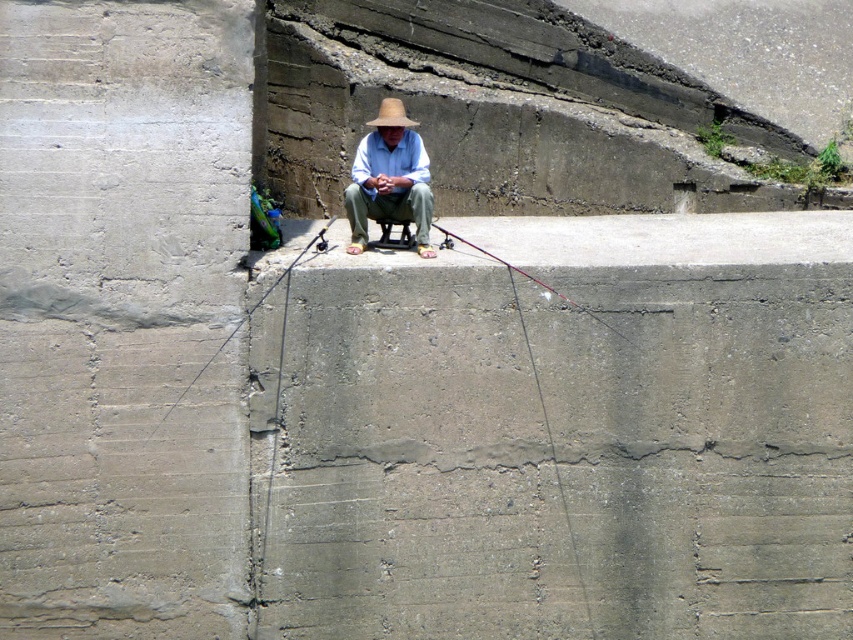
Can you confirm if matte straw hat at center is wider than beige woven straw hat at center?

Yes.

Is matte straw hat at center taller than beige woven straw hat at center?

Yes.

What are the coordinates of `matte straw hat at center` in the screenshot? It's located at click(x=389, y=179).

You are a GUI agent. You are given a task and a screenshot of the screen. Output one action in this format:
    pyautogui.click(x=<x>, y=<y>)
    Task: Click on the matte straw hat at center
    
    Given the screenshot: What is the action you would take?
    pyautogui.click(x=389, y=179)